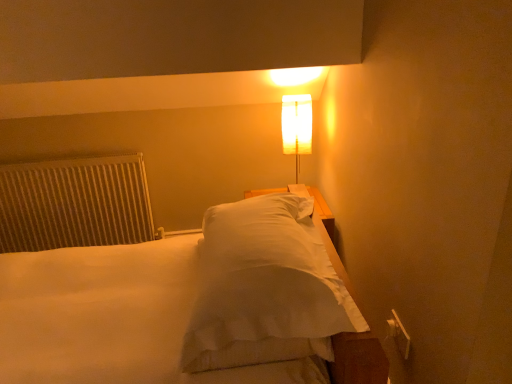
The width and height of the screenshot is (512, 384). Identify the location of free spot above white textured radiator at left (from a real-world perspective). pyautogui.click(x=64, y=161).